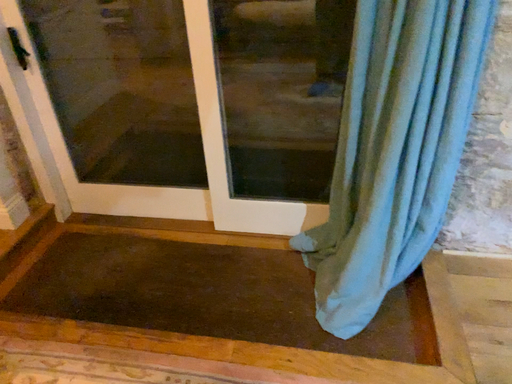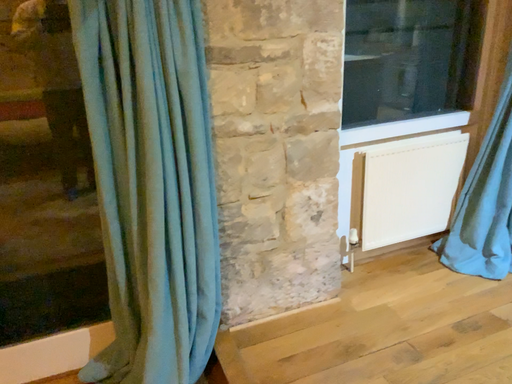
Question: Which way did the camera rotate in the video?

Choices:
 (A) rotated upward
 (B) rotated downward

Answer: (A)